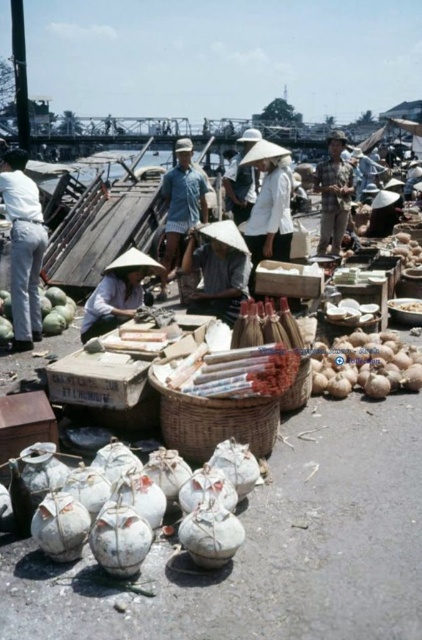
How distant is denim shirt at center from green leafy vegetable at lower left?

6.44 feet

Does point (184, 234) lie behind point (43, 330)?

Yes, it is behind point (43, 330).

Image resolution: width=422 pixels, height=640 pixels. In order to click on denim shirt at center in this screenshot , I will do `click(181, 205)`.

Is white cotton pants at left smaller than smooth brown coconuts at center?

No, white cotton pants at left is not smaller than smooth brown coconuts at center.

The image size is (422, 640). In order to click on white cotton pants at left in this screenshot , I will do `click(23, 246)`.

I want to click on white cotton pants at left, so click(23, 246).

Between point (376, 349) and point (213, 282), which one is positioned behind?

The point (213, 282) is behind.

Image resolution: width=422 pixels, height=640 pixels. Describe the element at coordinates (365, 365) in the screenshot. I see `smooth brown coconuts at center` at that location.

Find the location of `smooth brown coconuts at center`. smooth brown coconuts at center is located at coordinates (365, 365).